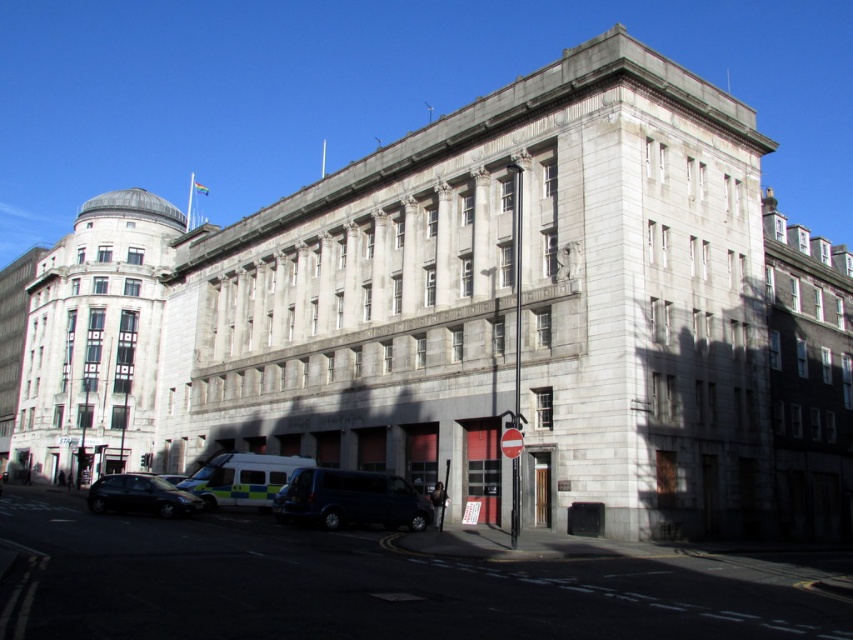
You are standing in front of the building and want to park your car. The parking spot is marked by the point at coordinates [350,499]. What vehicle is currently occupying that spot?

The point at coordinates [350,499] corresponds to the dark blue van at center, so the dark blue van at center is occupying that parking spot.

You are a delivery driver who needs to park your vehicle in the parking lot near the building. You have a dark blue van at center and a white glossy ambulance at lower left. Which vehicle should you choose to ensure you can fit into a parking spot that is only 4 meters long?

The dark blue van at center is smaller than the white glossy ambulance at lower left, so you should choose the dark blue van at center to fit into the 4 meter parking spot.